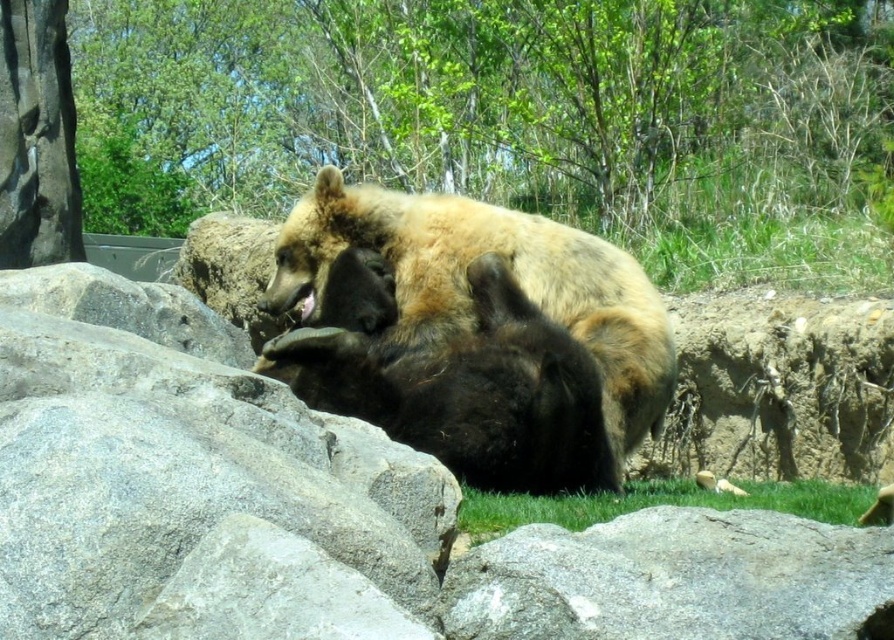
In the scene with the green leafy tree at upper center and the light brown fur bear at center, which object takes up more space in the image?

The green leafy tree at upper center is bigger than the light brown fur bear at center, so it takes up more space in the image.

You are a zookeeper observing the bears in their enclosure. You notice the green leafy tree at upper center and the light brown fur bear at center. Which object is taller?

The green leafy tree at upper center is taller than the light brown fur bear at center.

You are a small animal trying to cross the area where the gray rough rock at lower center and the green grass at lower center are located. Which surface would you choose to walk on if you want to avoid obstacles?

The green grass at lower center is taller than the gray rough rock at lower center, so choosing the gray rough rock at lower center would provide a smoother path with fewer obstacles.